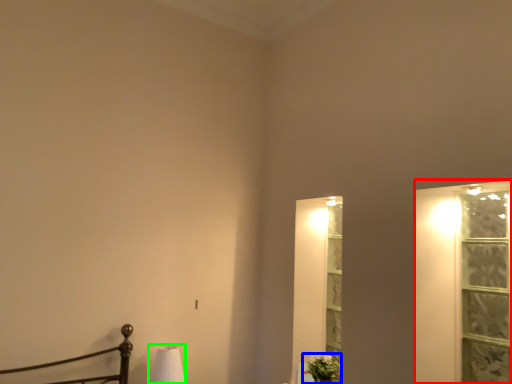
Question: Estimate the real-world distances between objects in this image. Which object is farther from window frame (highlighted by a red box), plant (highlighted by a blue box) or table lamp (highlighted by a green box)?

Choices:
 (A) plant
 (B) table lamp

Answer: (B)